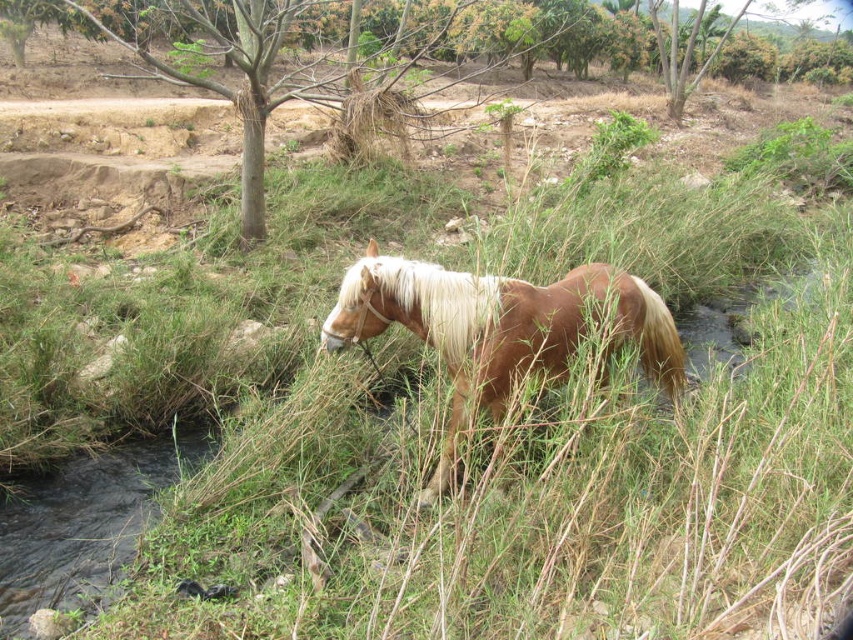
Which of these two, brown glossy horse at center or white silky mane at center, stands taller?

brown glossy horse at center is taller.

Can you confirm if brown glossy horse at center is wider than white silky mane at center?

Indeed, brown glossy horse at center has a greater width compared to white silky mane at center.

Who is more distant from viewer, [511,356] or [387,269]?

Positioned behind is point [511,356].

Find the location of a particular element. This screenshot has height=640, width=853. brown glossy horse at center is located at coordinates (496, 326).